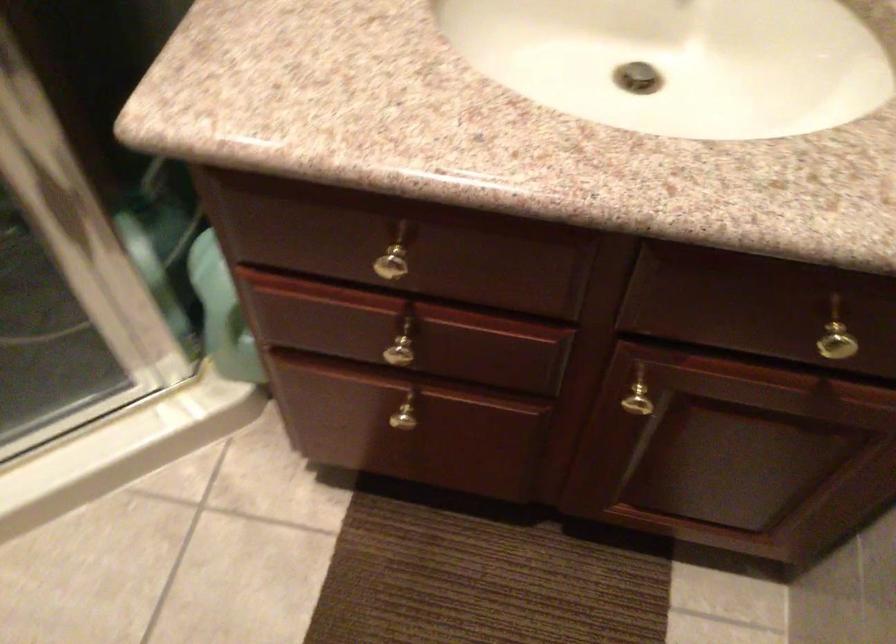
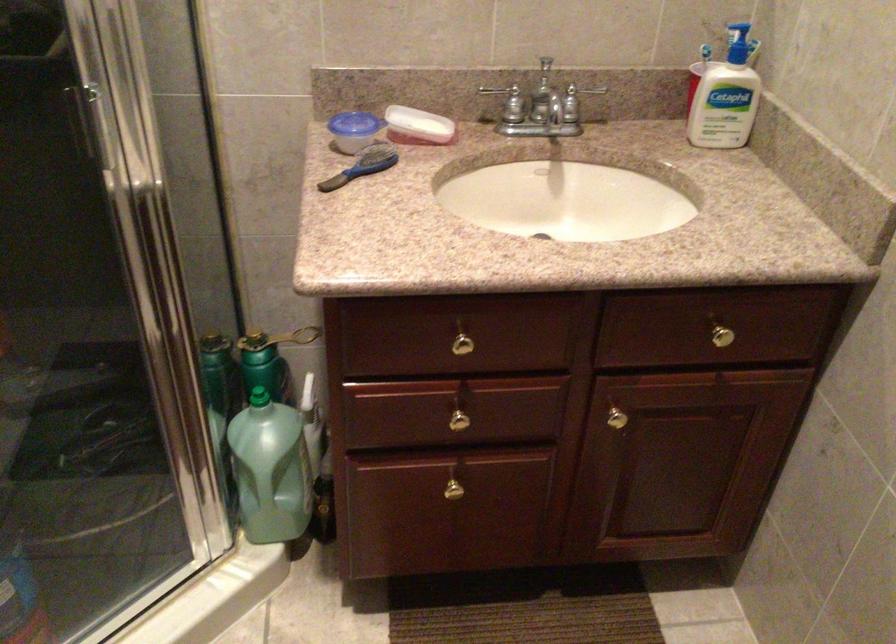
In the second image, find the point that corresponds to the point at 408,343 in the first image.

(459, 415)